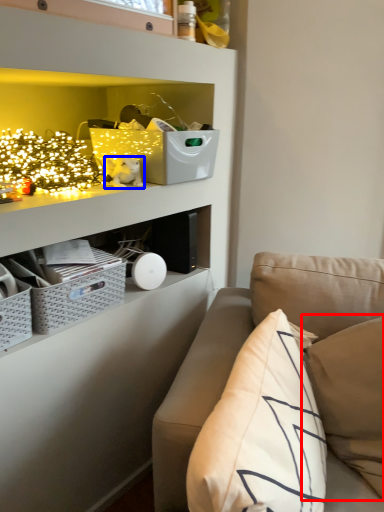
Question: Which of the following is the closest to the observer, pillow (highlighted by a red box) or toy (highlighted by a blue box)?

Choices:
 (A) pillow
 (B) toy

Answer: (A)